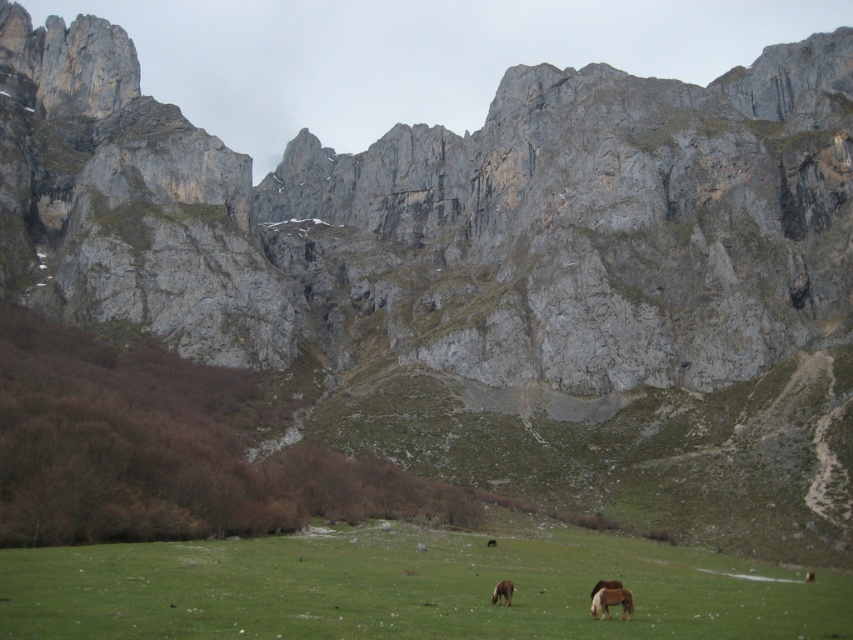
You are standing at the point with coordinates point [630,616] and want to reach the point with coordinates point [170,573]. Which direction should you move to get closer to your destination?

You should move forward because point [170,573] is behind point [630,616], so moving in the direction away from the observer would take you closer to the destination.

You are a hiker standing on the green grass pasture at lower center and want to reach the brown matte horse at center. Which direction should you move to get closer to the horse?

To reach the brown matte horse at center from the green grass pasture at lower center, you should move upward since the pasture is below the horse.

You are a hiker trying to cross the green grass pasture at lower center. There is a brown matte horse at center blocking your path. Can you walk around the horse without leaving the pasture?

A: The green grass pasture at lower center has a greater height compared to the brown matte horse at center, so yes, you can walk around the horse while staying within the pasture since the pasture extends beyond the horse in height.